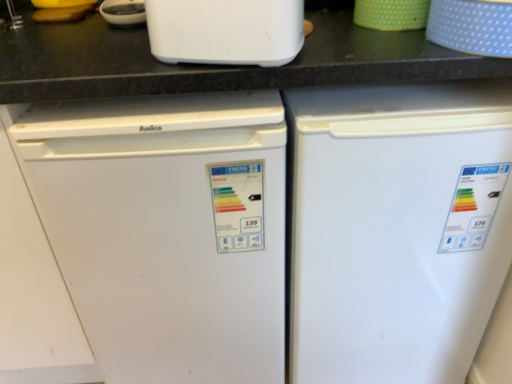
Question: Is point (81, 294) positioned closer to the camera than point (188, 56)?

Choices:
 (A) farther
 (B) closer

Answer: (A)

Question: Is white matte refrigerator at left, the first refrigerator from the left, situated inside white plastic toaster at upper center or outside?

Choices:
 (A) inside
 (B) outside

Answer: (B)

Question: Which object is positioned farthest from the white matte refrigerator at left, the second refrigerator when ordered from right to left?

Choices:
 (A) white plastic toaster at upper center
 (B) green dotted cup at upper right, the second appliance positioned from the right
 (C) blue dotted fabric at upper right, which ranks as the second appliance in left-to-right order
 (D) white matte refrigerator at center, which is the 1th refrigerator in right-to-left order

Answer: (C)

Question: Estimate the real-world distances between objects in this image. Which object is closer to the white matte refrigerator at left, the second refrigerator when ordered from right to left?

Choices:
 (A) white matte refrigerator at center, which appears as the second refrigerator when viewed from the left
 (B) blue dotted fabric at upper right, the first appliance viewed from the right
 (C) white plastic toaster at upper center
 (D) green dotted cup at upper right, which appears as the 1th appliance when viewed from the left

Answer: (A)